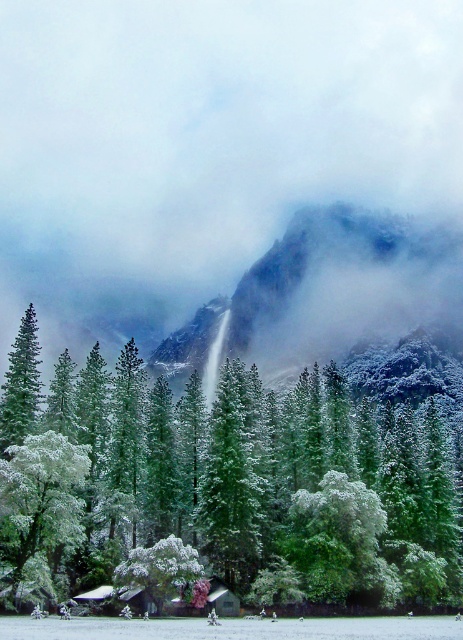
You are an airplane pilot flying over the mountain landscape. You notice the white fluffy cloud at upper center and the snowy rocky mountain at center. Which one is taller from your viewpoint?

The white fluffy cloud at upper center has a greater height compared to the snowy rocky mountain at center, so the white fluffy cloud at upper center is taller.

You are a photographer standing at the base of the mountain, aiming to capture the white fluffy cloud at upper center in your photo. Your camera has a maximum focus range of 50 meters. Can you capture the cloud clearly?

The white fluffy cloud at upper center is 58.79 meters away from the camera, which exceeds the maximum focus range of 50 meters. Therefore, the photographer cannot capture the cloud clearly.